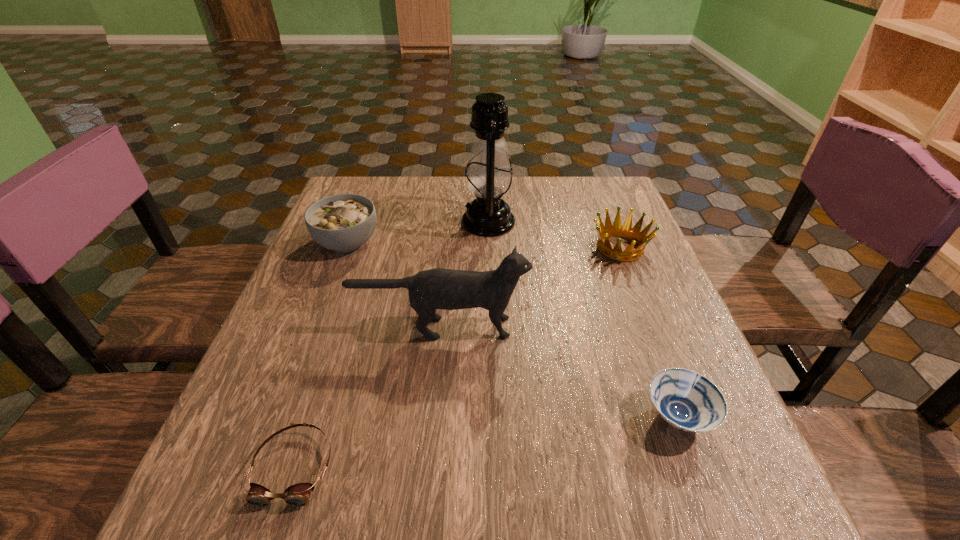
Where is `vacant area located 0.060m on the front-facing side of the third nearest object`? vacant area located 0.060m on the front-facing side of the third nearest object is located at coordinates (556, 327).

Locate an element on the screen. The width and height of the screenshot is (960, 540). blank area located on the back of the left soup bowl is located at coordinates (361, 206).

In order to click on vacant space located on the left of the third shortest object in this screenshot , I will do `click(453, 248)`.

The height and width of the screenshot is (540, 960). In order to click on free region located on the left of the right soup bowl in this screenshot , I will do 447,416.

Identify the location of object present at the far edge. This screenshot has width=960, height=540. (489, 177).

This screenshot has width=960, height=540. Find the location of `object located at the near edge`. object located at the near edge is located at coordinates (298, 495).

Image resolution: width=960 pixels, height=540 pixels. In order to click on soup bowl at the left edge in this screenshot , I will do `click(344, 222)`.

Locate an element on the screen. goggles positioned at the left edge is located at coordinates (298, 495).

This screenshot has width=960, height=540. Find the location of `crown that is at the right edge`. crown that is at the right edge is located at coordinates (634, 234).

Identify the location of soup bowl at the right edge. This screenshot has width=960, height=540. (685, 399).